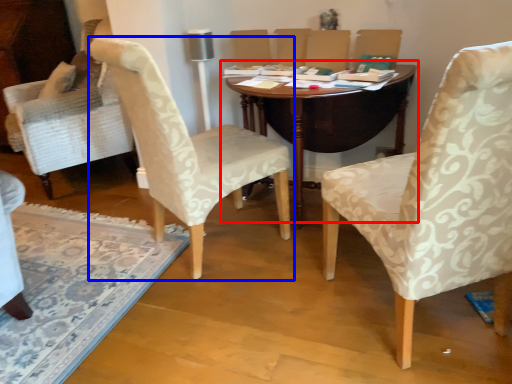
Question: Which of the following is the closest to the observer, table (highlighted by a red box) or chair (highlighted by a blue box)?

Choices:
 (A) table
 (B) chair

Answer: (B)